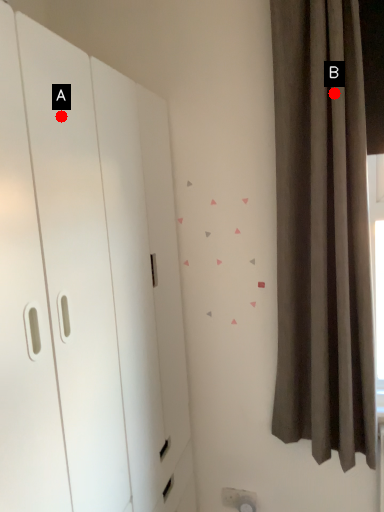
Question: Two points are circled on the image, labeled by A and B beside each circle. Which of the following is the closest to the observer?

Choices:
 (A) A is closer
 (B) B is closer

Answer: (A)